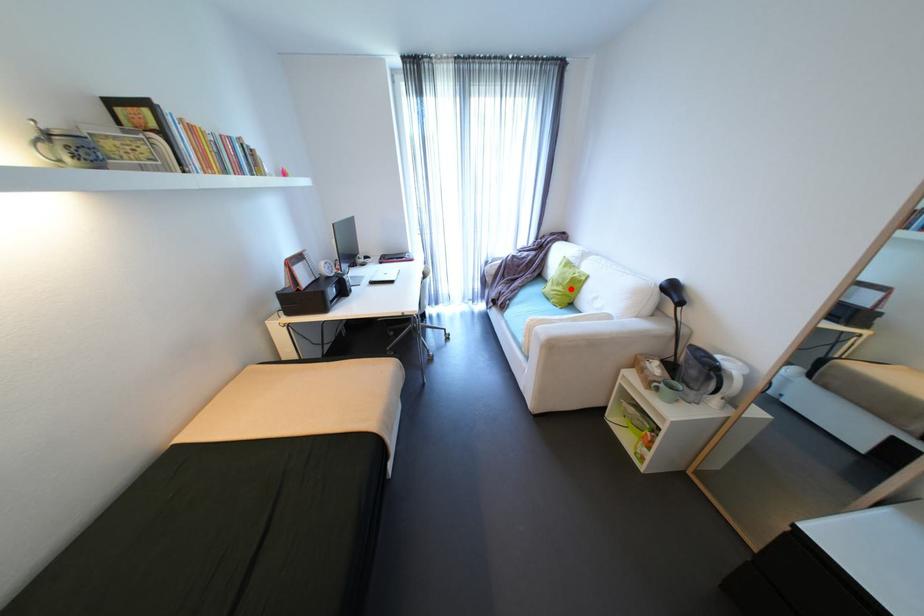
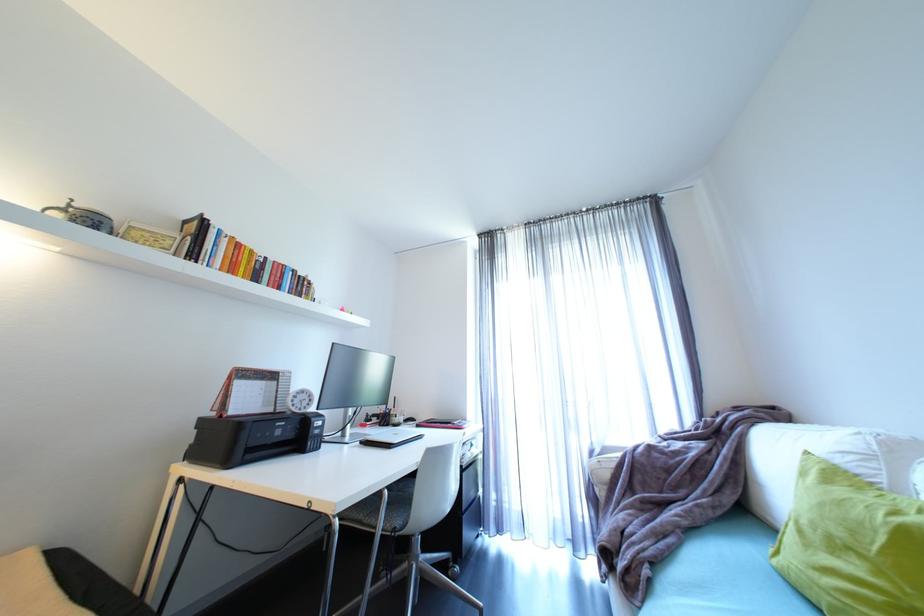
Question: I am providing you with two images of the same scene from different viewpoints. Image1 has a red point marked. In image2, the corresponding 3D location appears at what relative position? Reply with the corresponding letter.

Choices:
 (A) Closer
 (B) Farther

Answer: (B)